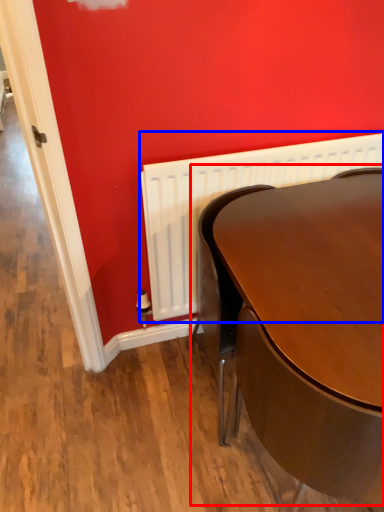
Question: Which of the following is the closest to the observer, table (highlighted by a red box) or radiator (highlighted by a blue box)?

Choices:
 (A) table
 (B) radiator

Answer: (A)